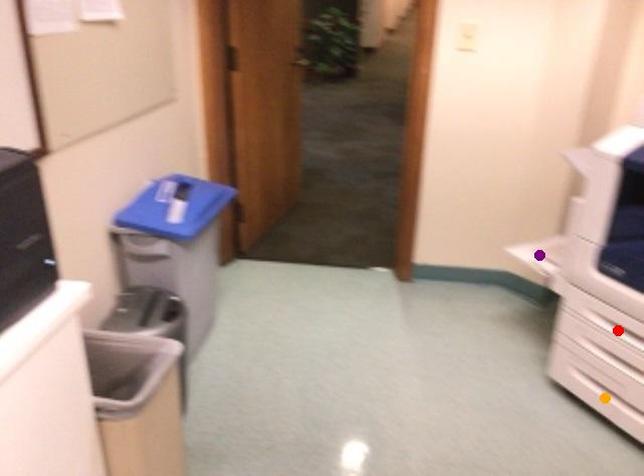
Order these from nearest to farthest:
1. red point
2. purple point
3. orange point

red point → orange point → purple point